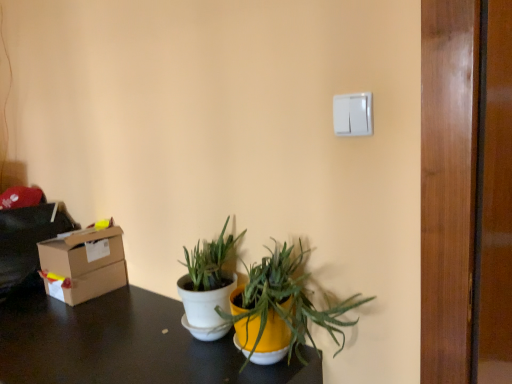
This screenshot has width=512, height=384. I want to click on vacant space positioned to the left of white matte pot at center, the first houseplant when ordered from left to right, so click(128, 344).